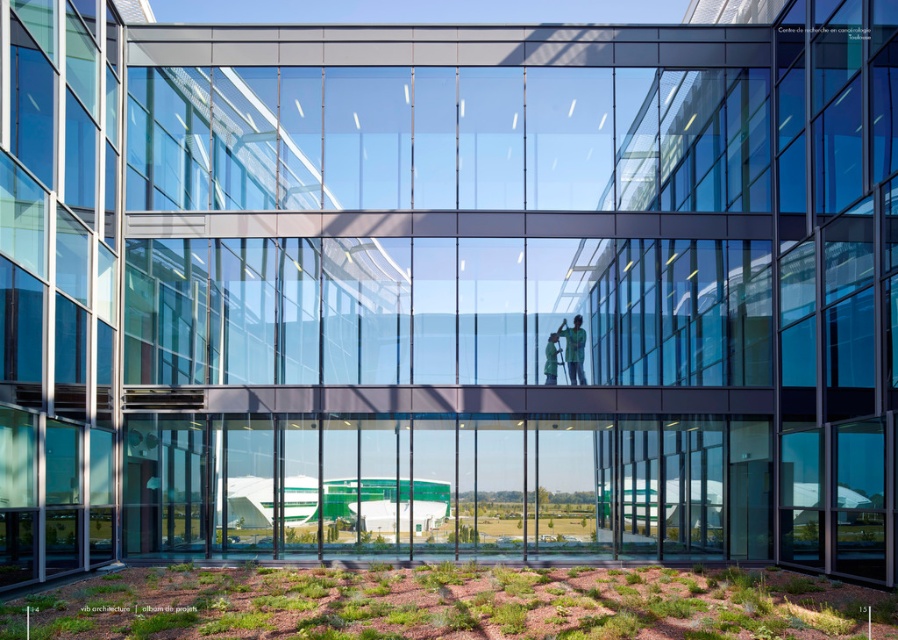
Question: Considering the relative positions of green fabric person at center and green fabric at center in the image provided, where is green fabric person at center located with respect to green fabric at center?

Choices:
 (A) below
 (B) above

Answer: (B)

Question: Is green fabric person at center positioned at the back of green fabric at center?

Choices:
 (A) yes
 (B) no

Answer: (B)

Question: Which point is farther from the camera taking this photo?

Choices:
 (A) coord(577,371)
 (B) coord(546,371)

Answer: (A)

Question: Can you confirm if green fabric person at center is positioned above green fabric at center?

Choices:
 (A) no
 (B) yes

Answer: (B)